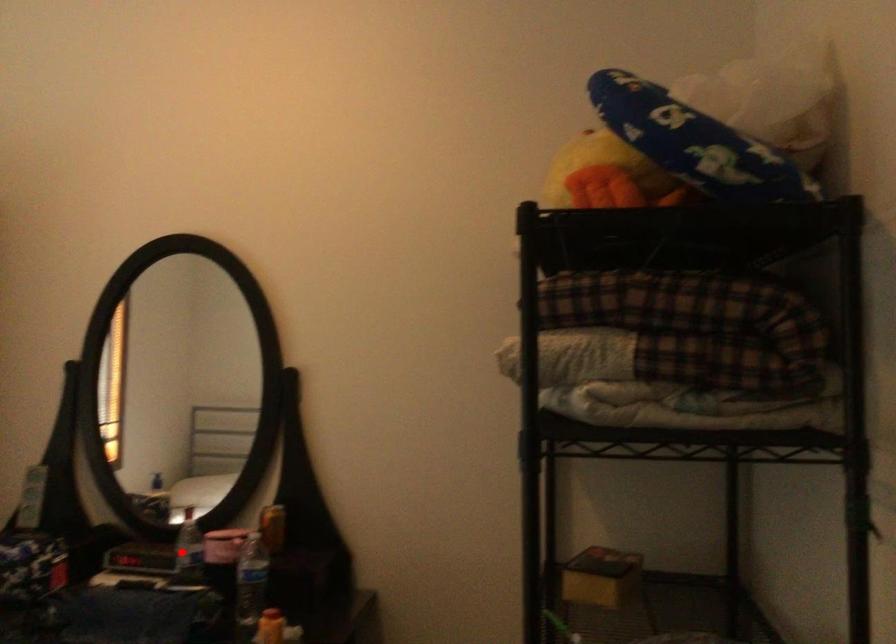
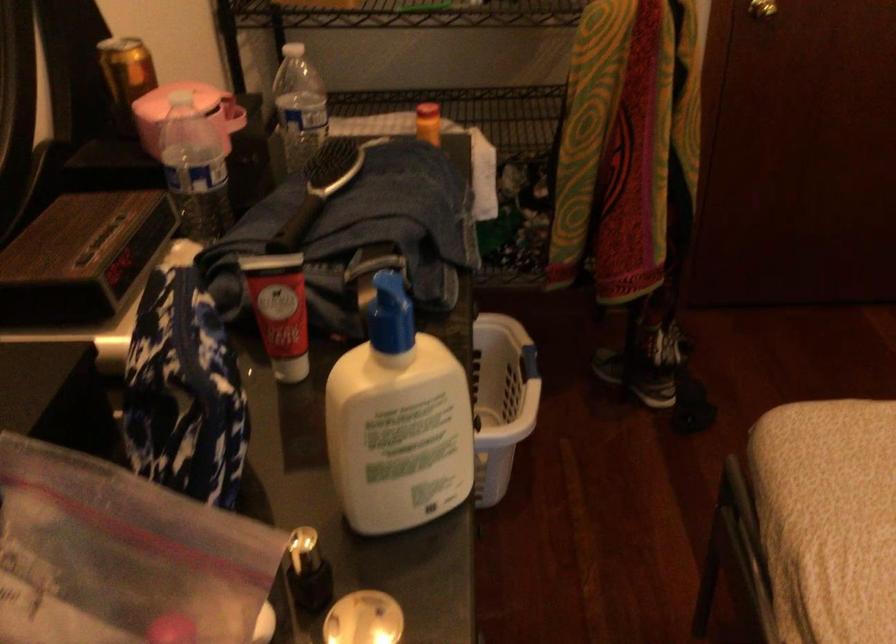
Locate, in the second image, the point that corresponds to the highlighted location in the first image.

(194, 169)